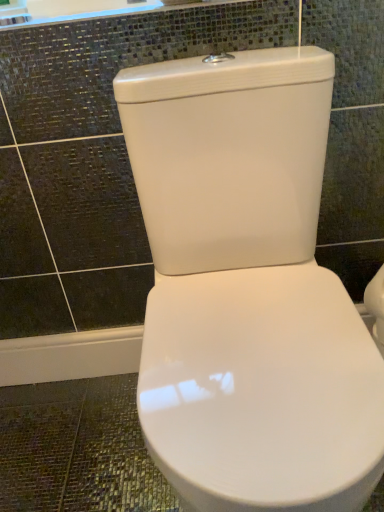
This screenshot has height=512, width=384. What do you see at coordinates (247, 288) in the screenshot? I see `white glossy toilet at center` at bounding box center [247, 288].

Image resolution: width=384 pixels, height=512 pixels. Find the location of `white glossy toilet at center`. white glossy toilet at center is located at coordinates (247, 288).

Find the location of a particular element. This screenshot has height=512, width=384. white glossy toilet at center is located at coordinates (247, 288).